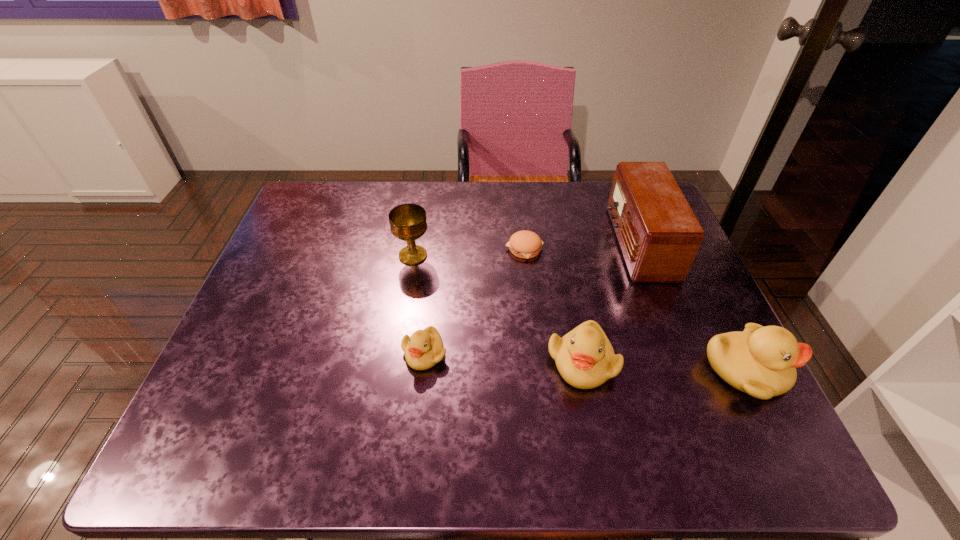
Locate an element on the screen. This screenshot has width=960, height=540. free space located on the front-facing side of the radio receiver is located at coordinates (473, 242).

Identify the location of free space located 0.130m on the back of the chalice. The width and height of the screenshot is (960, 540). (420, 216).

The image size is (960, 540). What are the coordinates of `vacant space located 0.320m on the left of the shortest object` in the screenshot? It's located at pos(390,248).

Locate an element on the screen. The width and height of the screenshot is (960, 540). object that is positioned at the far edge is located at coordinates (659, 235).

Locate an element on the screen. This screenshot has width=960, height=540. duckling positioned at the right edge is located at coordinates (761, 361).

Locate an element on the screen. The image size is (960, 540). radio receiver present at the right edge is located at coordinates (659, 235).

Locate an element on the screen. This screenshot has height=540, width=960. object located in the far right corner section of the desktop is located at coordinates (659, 235).

The image size is (960, 540). I want to click on object situated at the near right corner, so click(x=761, y=361).

In the image, there is a desktop. At what (x,y) coordinates should I click in order to perform the action: click on vacant space at the far edge. Please return your answer as a coordinate pair (x, y). The height and width of the screenshot is (540, 960). Looking at the image, I should click on (477, 207).

In the image, there is a desktop. At what (x,y) coordinates should I click in order to perform the action: click on free region at the near edge. Please return your answer as a coordinate pair (x, y). The width and height of the screenshot is (960, 540). Looking at the image, I should click on (619, 379).